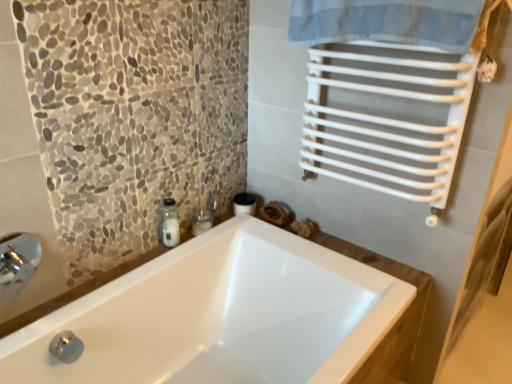
Question: Considering the relative positions of clear glass jar at center and white glossy bathtub at center in the image provided, is clear glass jar at center to the left or to the right of white glossy bathtub at center?

Choices:
 (A) left
 (B) right

Answer: (A)

Question: Based on their sizes in the image, would you say clear glass jar at center is bigger or smaller than white glossy bathtub at center?

Choices:
 (A) big
 (B) small

Answer: (B)

Question: Estimate the real-world distances between objects in this image. Which object is farther from the silver metallic faucet at lower left?

Choices:
 (A) clear glass jar at center
 (B) clear glass jar at upper left
 (C) white glossy bathtub at center

Answer: (A)

Question: Which of these objects is positioned farthest from the white glossy bathtub at center?

Choices:
 (A) clear glass jar at upper left
 (B) clear glass jar at center
 (C) silver metallic faucet at lower left

Answer: (C)